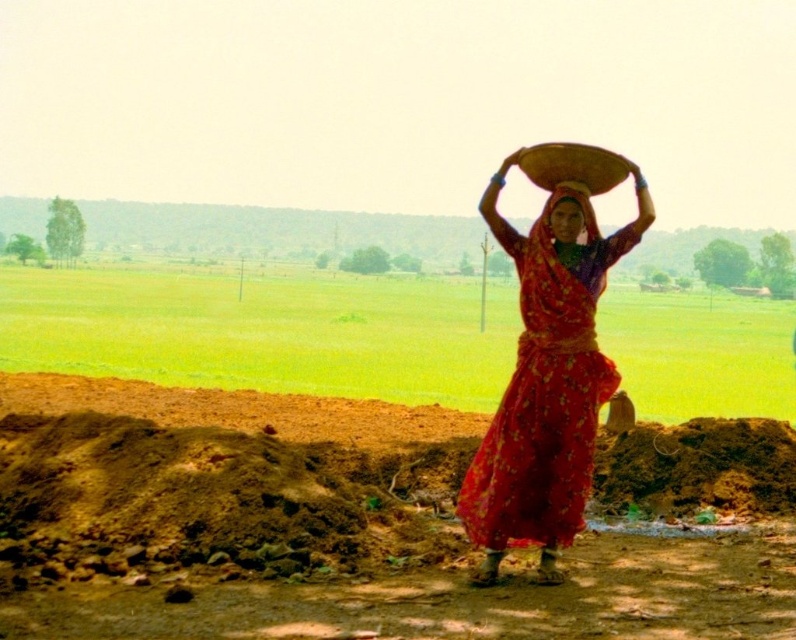
In order to click on matte red fabric at center in this screenshot , I will do pos(545,380).

Between point (544, 532) and point (578, 189), which one is positioned behind?

The point (578, 189) is behind.

Is point (578, 481) closer to viewer compared to point (564, 182)?

Yes.

Locate an element on the screen. This screenshot has height=640, width=796. matte red fabric at center is located at coordinates click(545, 380).

Locate an element on the screen. This screenshot has height=640, width=796. brown soil at center is located at coordinates (313, 529).

Is point (150, 612) positioned before point (621, 362)?

Yes, it is.

Find the location of `brown soil at center`. brown soil at center is located at coordinates (313, 529).

Is point (116, 324) positioned before point (556, 188)?

No, (116, 324) is behind (556, 188).

Does green grass at center lie in front of matte red fabric head at center?

Yes, it is.

Does point (184, 365) lie behind point (553, 186)?

Yes, it is.

What are the coordinates of `green grass at center` in the screenshot? It's located at (263, 332).